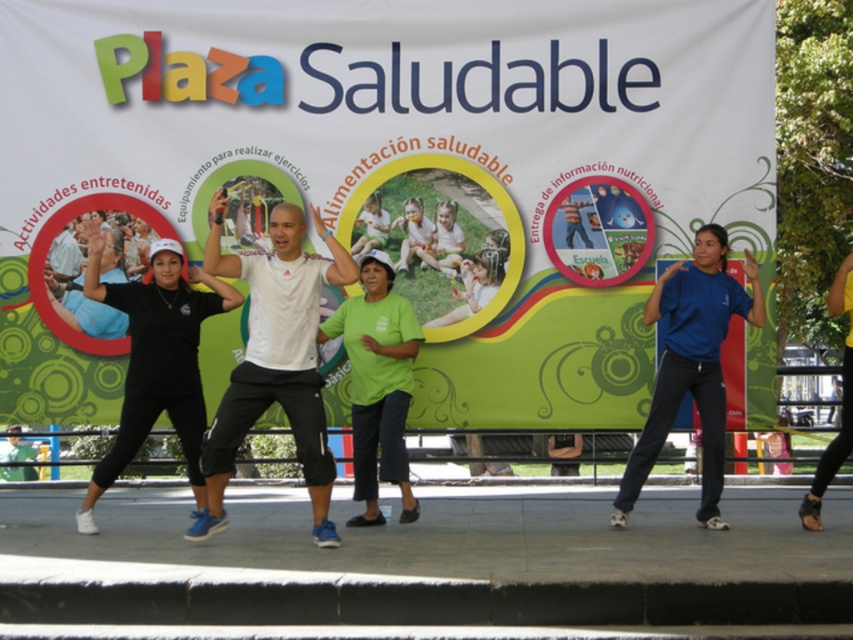
The width and height of the screenshot is (853, 640). What do you see at coordinates (157, 360) in the screenshot?
I see `black matte shirt at center` at bounding box center [157, 360].

Who is shorter, black matte shirt at center or blue matte shirt at center?

Standing shorter between the two is black matte shirt at center.

In the scene shown: Who is more forward, (192, 483) or (737, 285)?

Point (192, 483) is in front.

Identify the location of black matte shirt at center. This screenshot has width=853, height=640. (157, 360).

From the picture: Does white matte t-shirt at center appear on the right side of blue matte shirt at center?

In fact, white matte t-shirt at center is to the left of blue matte shirt at center.

Is point (254, 372) positioned behind point (682, 273)?

That is False.

Which is behind, point (347, 276) or point (643, 438)?

Positioned behind is point (643, 438).

This screenshot has width=853, height=640. I want to click on white matte t-shirt at center, so click(276, 356).

Is white paper banner at upper center wider than black matte shirt at center?

Yes, white paper banner at upper center is wider than black matte shirt at center.

Between white paper banner at upper center and black matte shirt at center, which one is positioned higher?

white paper banner at upper center

What do you see at coordinates (389, 173) in the screenshot? I see `white paper banner at upper center` at bounding box center [389, 173].

Where is `white paper banner at upper center`? Image resolution: width=853 pixels, height=640 pixels. white paper banner at upper center is located at coordinates (389, 173).